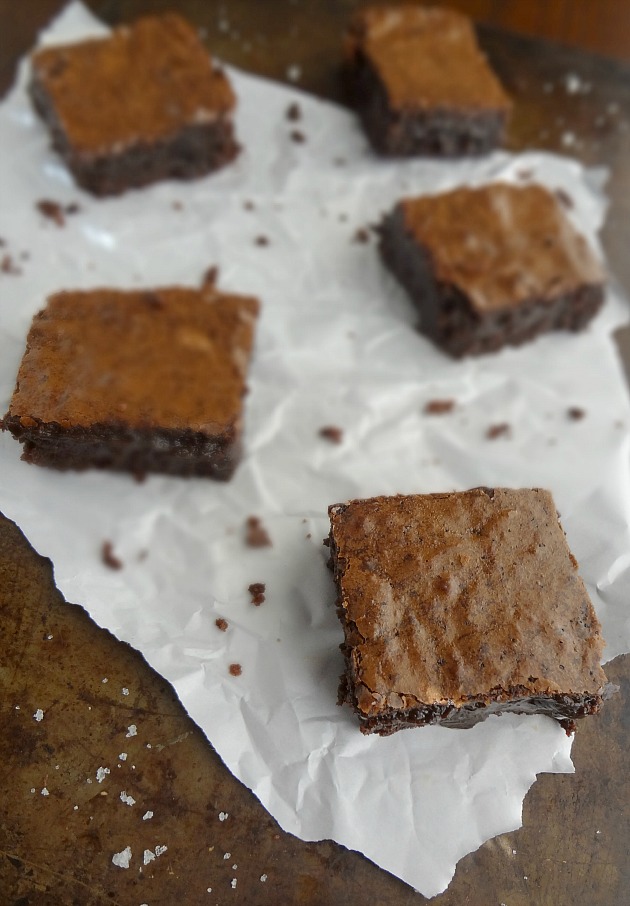
What are the coordinates of `blurred wall` in the screenshot? It's located at (570, 32).